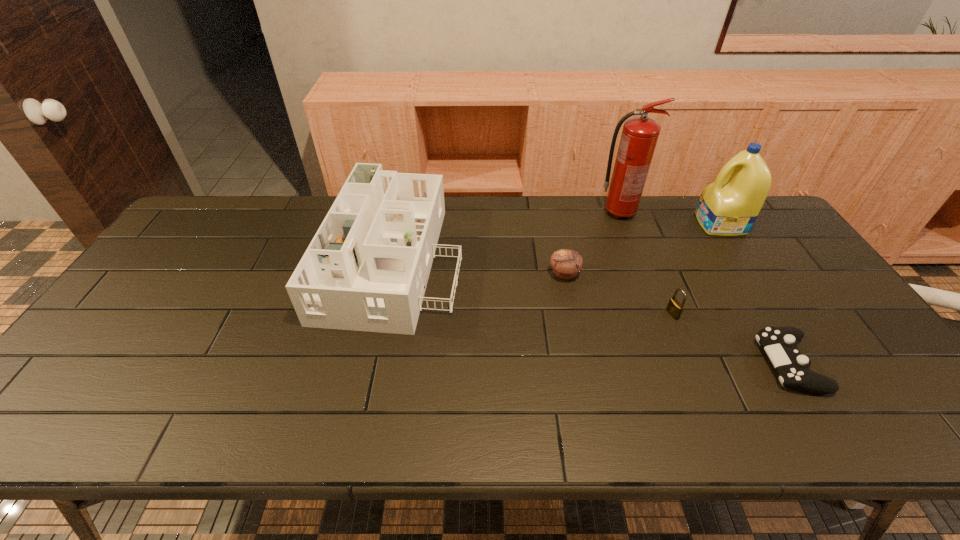
Locate an element on the screen. The height and width of the screenshot is (540, 960). object present at the right edge is located at coordinates (729, 206).

Identify the location of object located at the far right corner. Image resolution: width=960 pixels, height=540 pixels. (729, 206).

Where is `vacant space at the far edge of the desktop`? vacant space at the far edge of the desktop is located at coordinates (309, 203).

At what (x,y) coordinates should I click in order to perform the action: click on vacant space at the near edge. Please return your answer as a coordinate pair (x, y). Looking at the image, I should click on (540, 427).

In the image, there is a desktop. Where is `free space at the left edge`? This screenshot has width=960, height=540. free space at the left edge is located at coordinates (98, 383).

Identify the location of free region at the right edge of the desktop. (792, 264).

Where is `free region at the far left corner of the desktop`? This screenshot has height=540, width=960. free region at the far left corner of the desktop is located at coordinates (229, 205).

I want to click on unoccupied position between the dollhouse and the shortest object, so click(592, 310).

In order to click on unoccupied position between the fifth shortest object and the third tallest object in this screenshot , I will do `click(558, 240)`.

Find the location of `vacant area that lies between the padlock and the fifth object from right to left`. vacant area that lies between the padlock and the fifth object from right to left is located at coordinates (618, 294).